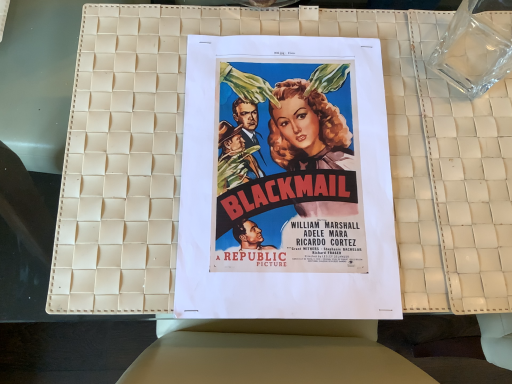
Image resolution: width=512 pixels, height=384 pixels. In order to click on matte paper poster at center in this screenshot , I will do `click(286, 181)`.

Image resolution: width=512 pixels, height=384 pixels. What do you see at coordinates (286, 181) in the screenshot? I see `matte paper poster at center` at bounding box center [286, 181].

The image size is (512, 384). Identify the location of matte paper poster at center. (286, 181).